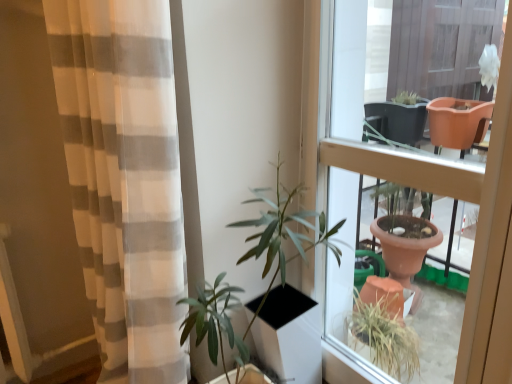
What do you see at coordinates (124, 178) in the screenshot? I see `white sheer curtain at left` at bounding box center [124, 178].

You are a GUI agent. You are given a task and a screenshot of the screen. Output one action in this format:
    pyautogui.click(x=<x>, y=<y>)
    Task: Click on the white sheer curtain at left
    
    Given the screenshot: What is the action you would take?
    pyautogui.click(x=124, y=178)

What do you see at coordinates (426, 191) in the screenshot?
I see `matte brown pot at center` at bounding box center [426, 191].

This screenshot has width=512, height=384. In order to click on matte brown pot at center in this screenshot , I will do (x=426, y=191).

Where is `white sheer curtain at left`? The image size is (512, 384). white sheer curtain at left is located at coordinates (124, 178).

Is matte brown pot at center to the left of white sheer curtain at left from the viewer's perspective?

In fact, matte brown pot at center is to the right of white sheer curtain at left.

Considering their positions, is matte brown pot at center located in front of or behind white sheer curtain at left?

Visually, matte brown pot at center is located behind white sheer curtain at left.

Does point (476, 214) lie in front of point (96, 103)?

No, it is behind (96, 103).

From the image's perspective, would you say matte brown pot at center is shown under white sheer curtain at left?

Actually, matte brown pot at center appears above white sheer curtain at left in the image.

From a real-world perspective, which object rests below the other?

white sheer curtain at left, from a real-world perspective.

Can you confirm if matte brown pot at center is thinner than white sheer curtain at left?

Yes, matte brown pot at center is thinner than white sheer curtain at left.

Considering the sizes of matte brown pot at center and white sheer curtain at left in the image, is matte brown pot at center taller or shorter than white sheer curtain at left?

→ Clearly, matte brown pot at center is shorter compared to white sheer curtain at left.

Between matte brown pot at center and white sheer curtain at left, which one has larger size?

Bigger between the two is white sheer curtain at left.

In the scene shown: Is matte brown pot at center positioned beyond the bounds of white sheer curtain at left?

Yes, matte brown pot at center is located beyond the bounds of white sheer curtain at left.

Are matte brown pot at center and white sheer curtain at left making contact?

matte brown pot at center and white sheer curtain at left are clearly separated.

Could you tell me if matte brown pot at center is facing white sheer curtain at left?

Yes, matte brown pot at center faces towards white sheer curtain at left.

How different are the orientations of matte brown pot at center and white sheer curtain at left in degrees?

0.201 degrees.

This screenshot has height=384, width=512. Find the location of `window that is above the white sheer curtain at left (from a real-world perspective)`. window that is above the white sheer curtain at left (from a real-world perspective) is located at coordinates (426, 191).

Between white sheer curtain at left and matte brown pot at center, which one appears on the right side from the viewer's perspective?

Positioned to the right is matte brown pot at center.

Considering their positions, is white sheer curtain at left located in front of or behind matte brown pot at center?

In the image, white sheer curtain at left appears in front of matte brown pot at center.

Is point (168, 157) closer to viewer compared to point (341, 146)?

Yes, point (168, 157) is in front of point (341, 146).

From the image's perspective, does white sheer curtain at left appear higher than matte brown pot at center?

Incorrect, from the image's perspective, white sheer curtain at left is lower than matte brown pot at center.

From a real-world perspective, which object rests below the other?

From a 3D spatial view, white sheer curtain at left is below.

Which of these two, white sheer curtain at left or matte brown pot at center, is thinner?

Thinner between the two is matte brown pot at center.

From their relative heights in the image, would you say white sheer curtain at left is taller or shorter than matte brown pot at center?

Clearly, white sheer curtain at left is taller compared to matte brown pot at center.

Which of these two, white sheer curtain at left or matte brown pot at center, is bigger?

white sheer curtain at left is bigger.

Is white sheer curtain at left not inside matte brown pot at center?

Indeed, white sheer curtain at left is completely outside matte brown pot at center.

Does white sheer curtain at left touch matte brown pot at center?

No, white sheer curtain at left is not touching matte brown pot at center.

Could you tell me if white sheer curtain at left is turned towards matte brown pot at center?

No, white sheer curtain at left does not turn towards matte brown pot at center.

How different are the orientations of white sheer curtain at left and matte brown pot at center in degrees?

The angular difference between white sheer curtain at left and matte brown pot at center is 0.201 degrees.

Measure the distance between white sheer curtain at left and matte brown pot at center.

The distance of white sheer curtain at left from matte brown pot at center is 65.54 centimeters.

Where is `curtain in front of the matte brown pot at center`? curtain in front of the matte brown pot at center is located at coordinates (124, 178).

Find the location of a particular element. curtain in front of the matte brown pot at center is located at coordinates (124, 178).

The width and height of the screenshot is (512, 384). I want to click on window on the right of white sheer curtain at left, so click(x=426, y=191).